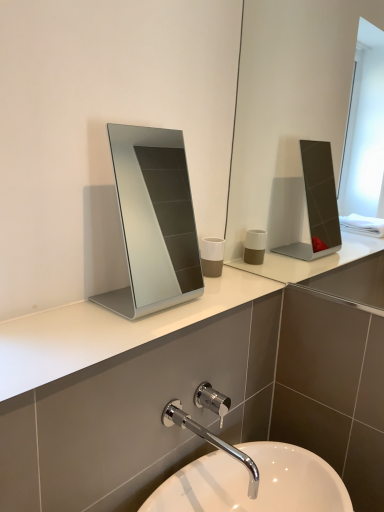
Question: From a real-world perspective, relative to chrome metallic faucet at lower center, is white matte cup at center vertically above or below?

Choices:
 (A) below
 (B) above

Answer: (B)

Question: Is white matte cup at center inside or outside of chrome metallic faucet at lower center?

Choices:
 (A) inside
 (B) outside

Answer: (B)

Question: Estimate the real-world distances between objects in this image. Which object is closer to the chrome metallic faucet at lower center?

Choices:
 (A) white matte cup at center
 (B) silver metallic mirror at center
 (C) white glossy sink at lower center

Answer: (C)

Question: Based on their relative distances, which object is nearer to the white matte cup at center?

Choices:
 (A) chrome metallic faucet at lower center
 (B) silver metallic mirror at center
 (C) white glossy sink at lower center

Answer: (A)